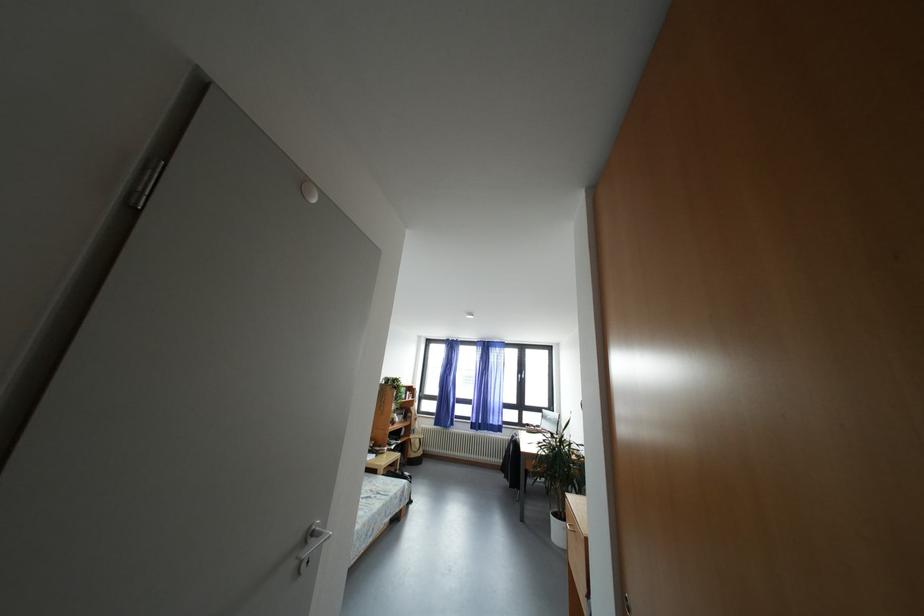
Where would you turn the radiator valve? Please return your answer as a coordinate pair (x, y).

(475, 448)